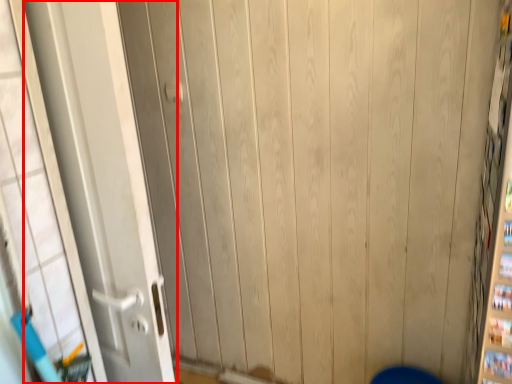
Question: From the image's perspective, where is door (annotated by the red box) located relative to door handle?

Choices:
 (A) above
 (B) below

Answer: (B)